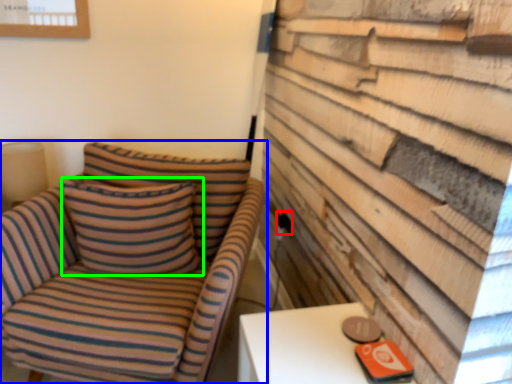
Question: Based on their relative distances, which object is farther from electric outlet (highlighted by a red box)? Choose from chair (highlighted by a blue box) and pillow (highlighted by a green box).

Choices:
 (A) chair
 (B) pillow

Answer: (A)